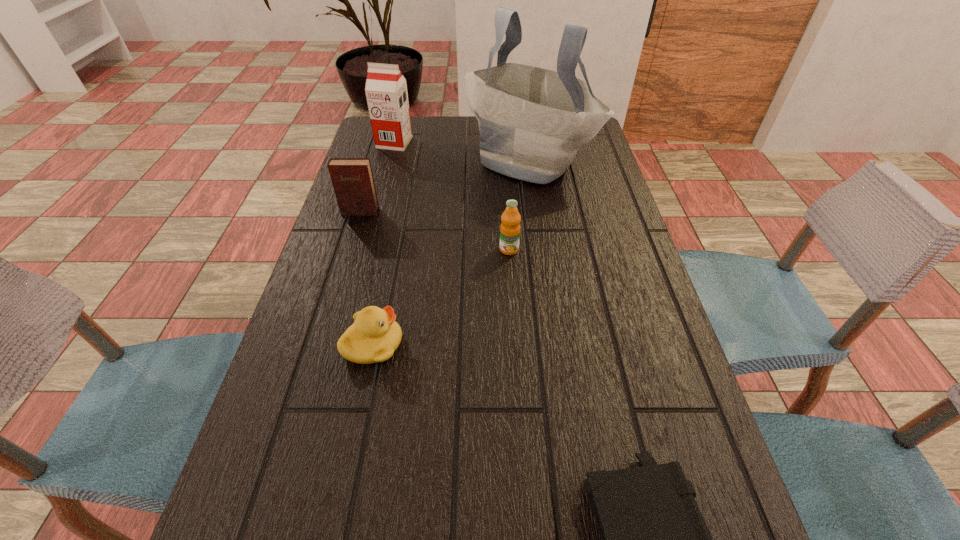
The height and width of the screenshot is (540, 960). I want to click on unoccupied position between the orange juice and the shopping bag, so click(518, 205).

Find the location of a particular element. This screenshot has width=960, height=540. free space between the tallest object and the fifth shortest object is located at coordinates pos(462,152).

You are a GUI agent. You are given a task and a screenshot of the screen. Output one action in this format:
    pyautogui.click(x=<x>, y=<y>)
    Task: Click on the vacant area that lies between the tallest object and the third nearest object
    The image size is (960, 540).
    Given the screenshot: What is the action you would take?
    (x=518, y=205)

Point out which object is positioned as the third nearest to the fifth farthest object. Please provide its 2D coordinates. Your answer should be formatted as a tuple, i.e. [(x, y)], where the tuple contains the x and y coordinates of a point satisfying the conditions above.

[(653, 538)]

I want to click on object that stands as the second closest to the fourth nearest object, so click(386, 92).

In order to click on free space that satisfies the following two spatial constraints: 1. on the label of the fourth farthest object; 2. on the beak of the duckling in this screenshot , I will do `click(516, 345)`.